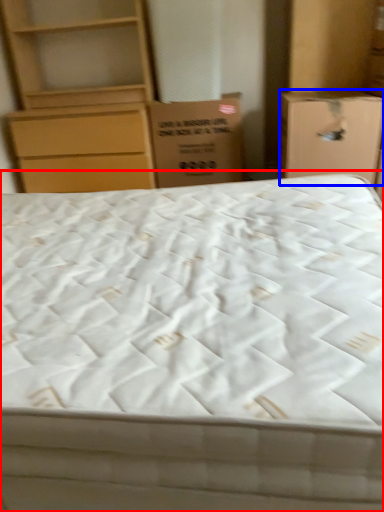
Question: Which object is closer to the camera taking this photo, bed (highlighted by a red box) or cardboard box (highlighted by a blue box)?

Choices:
 (A) bed
 (B) cardboard box

Answer: (A)